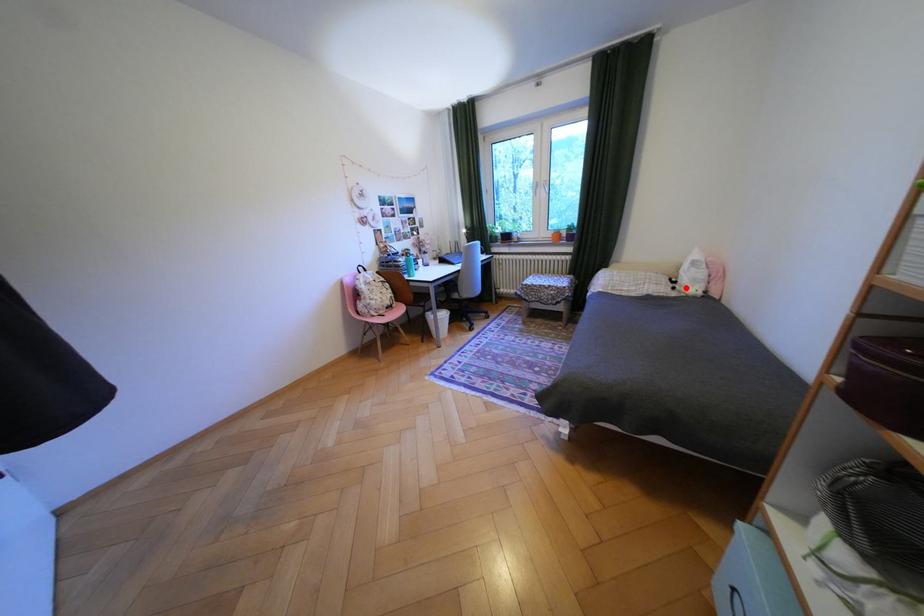
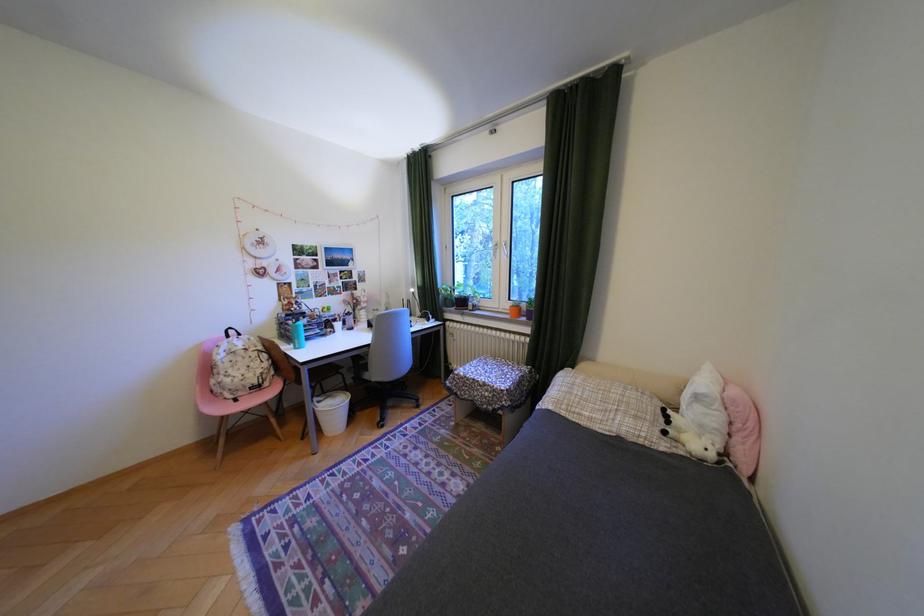
Where in the second image is the point corresponding to the highlighted location from the first image?

(676, 432)